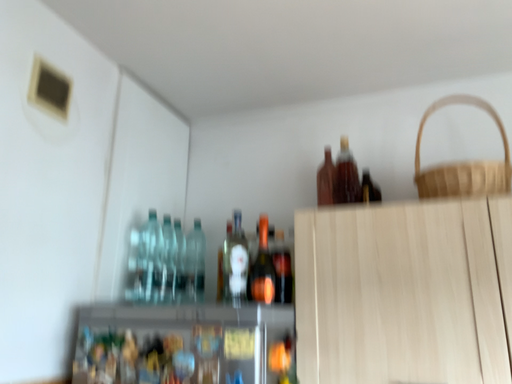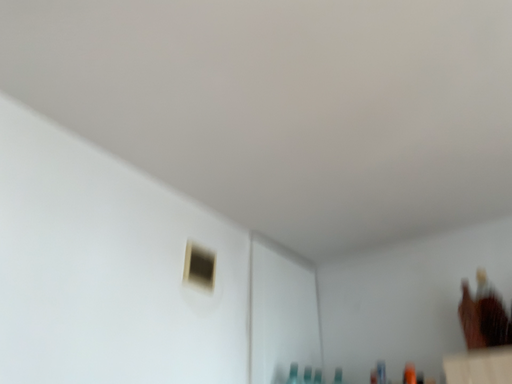
Question: Which way did the camera rotate in the video?

Choices:
 (A) rotated upward
 (B) rotated downward

Answer: (A)